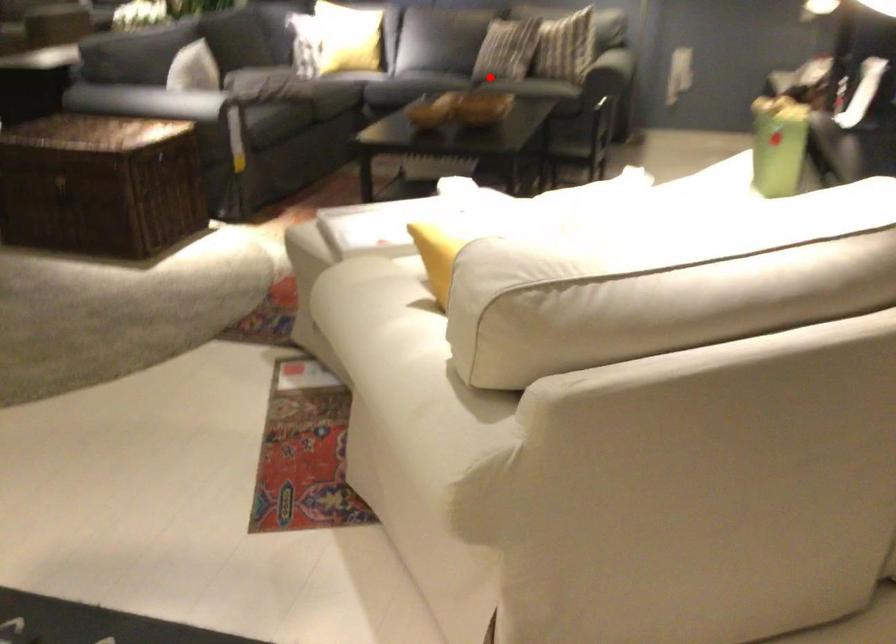
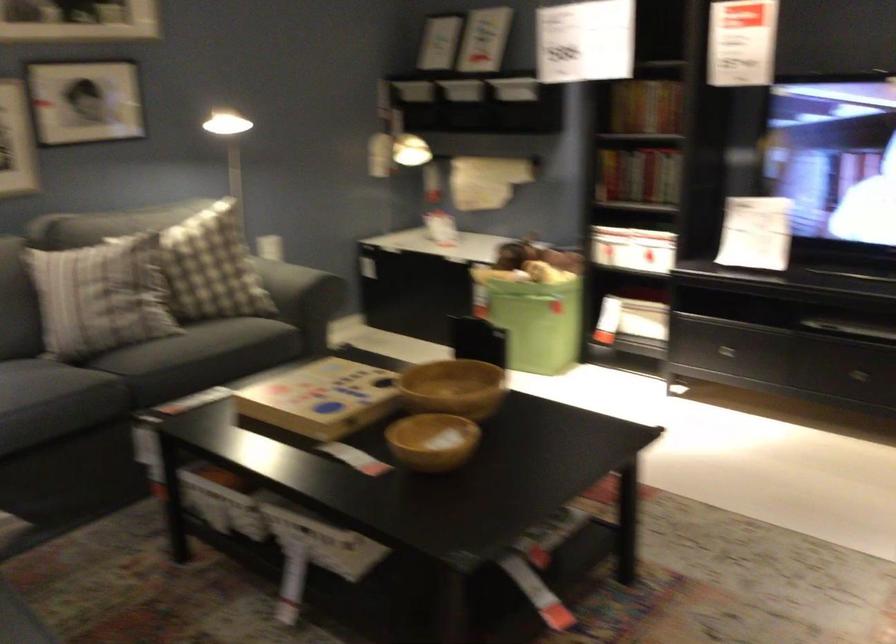
Question: A red point is marked in image1. In image2, is the corresponding 3D point closer to the camera or farther? Reply with the corresponding letter.

Choices:
 (A) The corresponding 3D point is closer.
 (B) The corresponding 3D point is farther.

Answer: (A)